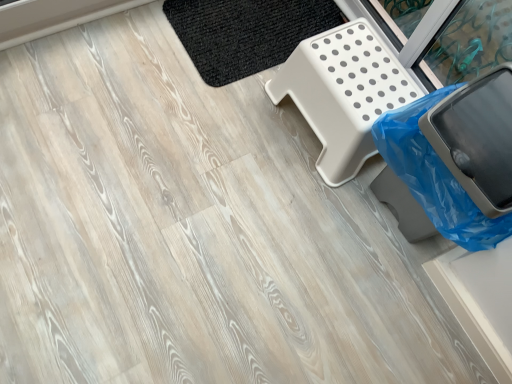
Question: Is black woven mat at upper center further to the viewer compared to blue plastic trash can at lower right?

Choices:
 (A) yes
 (B) no

Answer: (A)

Question: Is black woven mat at upper center at the left side of blue plastic trash can at lower right?

Choices:
 (A) yes
 (B) no

Answer: (A)

Question: Is black woven mat at upper center placed right next to blue plastic trash can at lower right?

Choices:
 (A) yes
 (B) no

Answer: (B)

Question: From a real-world perspective, is black woven mat at upper center beneath blue plastic trash can at lower right?

Choices:
 (A) yes
 (B) no

Answer: (A)

Question: From a real-world perspective, is black woven mat at upper center physically above blue plastic trash can at lower right?

Choices:
 (A) no
 (B) yes

Answer: (A)

Question: Is blue plastic trash can at lower right taller or shorter than black woven mat at upper center?

Choices:
 (A) tall
 (B) short

Answer: (A)

Question: Looking at the image, does blue plastic trash can at lower right seem bigger or smaller compared to black woven mat at upper center?

Choices:
 (A) big
 (B) small

Answer: (A)

Question: Based on their positions, is blue plastic trash can at lower right located to the left or right of black woven mat at upper center?

Choices:
 (A) left
 (B) right

Answer: (B)

Question: Would you say blue plastic trash can at lower right is inside or outside black woven mat at upper center?

Choices:
 (A) outside
 (B) inside

Answer: (A)

Question: Visually, is white plastic step stool at upper right positioned to the left or to the right of blue plastic trash can at lower right?

Choices:
 (A) left
 (B) right

Answer: (A)

Question: From the image's perspective, is white plastic step stool at upper right located above or below blue plastic trash can at lower right?

Choices:
 (A) below
 (B) above

Answer: (B)

Question: Considering the positions of white plastic step stool at upper right and blue plastic trash can at lower right in the image, is white plastic step stool at upper right wider or thinner than blue plastic trash can at lower right?

Choices:
 (A) wide
 (B) thin

Answer: (A)

Question: From a real-world perspective, is white plastic step stool at upper right above or below blue plastic trash can at lower right?

Choices:
 (A) above
 (B) below

Answer: (B)

Question: From their relative heights in the image, would you say black woven mat at upper center is taller or shorter than blue plastic trash can at lower right?

Choices:
 (A) tall
 (B) short

Answer: (B)

Question: From the image's perspective, relative to blue plastic trash can at lower right, is black woven mat at upper center above or below?

Choices:
 (A) below
 (B) above

Answer: (B)